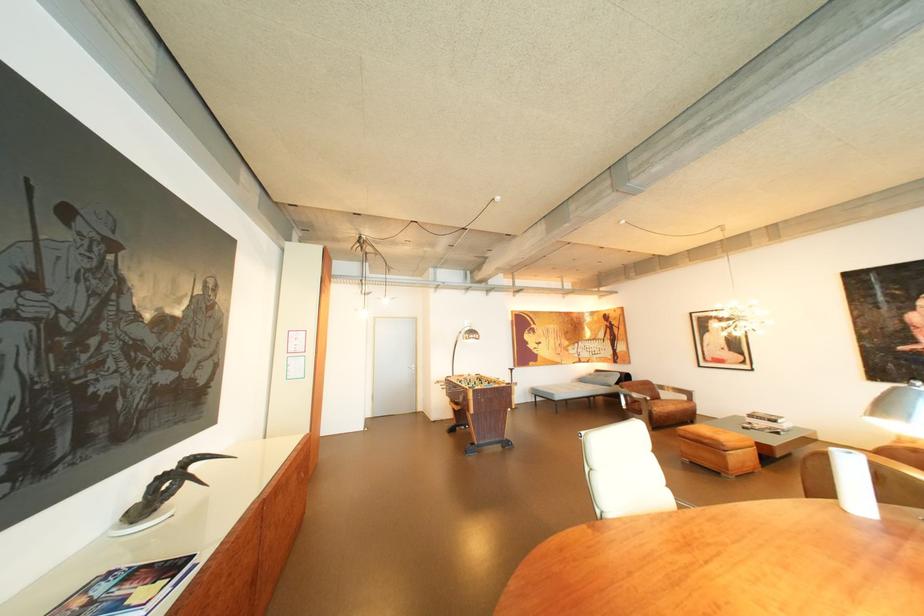
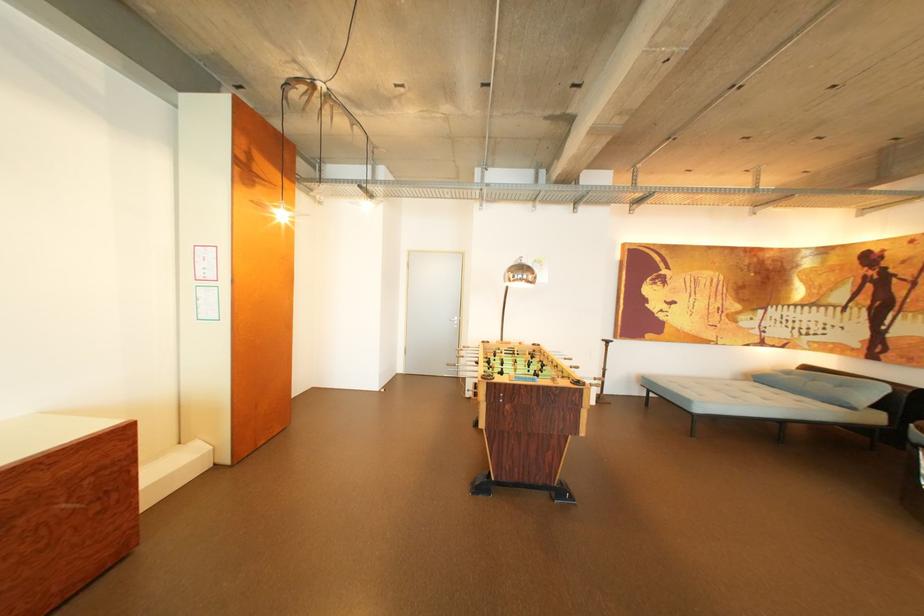
Question: What movement of the cameraman would produce the second image?

Choices:
 (A) Left
 (B) Right
 (C) Forward
 (D) Backward

Answer: (C)